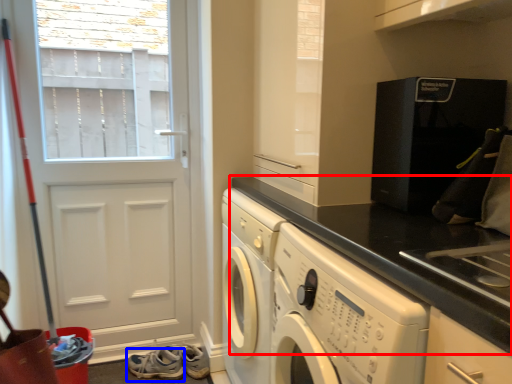
Question: Which object is closer to the camera taking this photo, countertop (highlighted by a red box) or shoe (highlighted by a blue box)?

Choices:
 (A) countertop
 (B) shoe

Answer: (A)